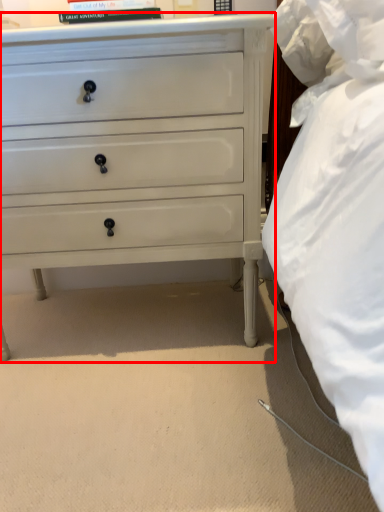
Question: From the image's perspective, where is chest of drawers (annotated by the red box) located relative to book?

Choices:
 (A) above
 (B) below

Answer: (B)